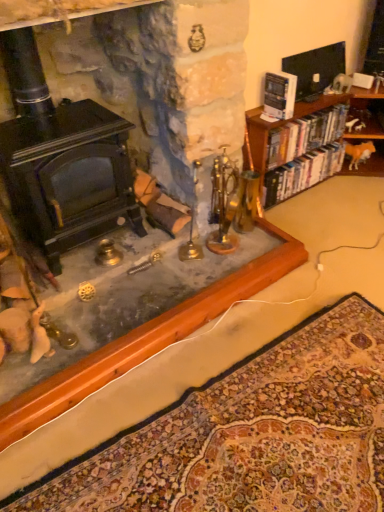
This screenshot has width=384, height=512. What are the coordinates of `vacant space in front of hardcover books at right, which ranks as the 3th book in front-to-back order` in the screenshot? It's located at (321, 227).